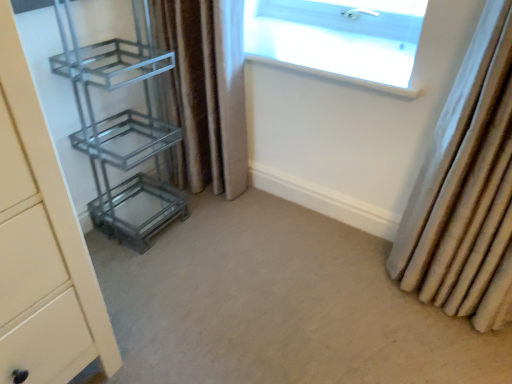
Question: From a real-world perspective, is beige carpet at center below metallic glass shelf at left?

Choices:
 (A) no
 (B) yes

Answer: (B)

Question: Is beige carpet at center facing away from metallic glass shelf at left?

Choices:
 (A) no
 (B) yes

Answer: (A)

Question: Does beige carpet at center lie in front of metallic glass shelf at left?

Choices:
 (A) yes
 (B) no

Answer: (A)

Question: Are beige carpet at center and metallic glass shelf at left far apart?

Choices:
 (A) no
 (B) yes

Answer: (A)

Question: Does beige carpet at center have a lesser height compared to metallic glass shelf at left?

Choices:
 (A) no
 (B) yes

Answer: (B)

Question: In the image, is beige fabric curtain at right, marked as the second curtain in a left-to-right arrangement, positioned in front of or behind transparent glass window at upper center?

Choices:
 (A) behind
 (B) front

Answer: (B)

Question: Would you say beige fabric curtain at right, which is counted as the 1th curtain, starting from the right, is inside or outside transparent glass window at upper center?

Choices:
 (A) outside
 (B) inside

Answer: (A)

Question: In the image, is beige fabric curtain at right, marked as the second curtain in a left-to-right arrangement, on the left side or the right side of transparent glass window at upper center?

Choices:
 (A) right
 (B) left

Answer: (A)

Question: Considering the positions of beige fabric curtain at right, which is counted as the 1th curtain, starting from the right, and transparent glass window at upper center in the image, is beige fabric curtain at right, which is counted as the 1th curtain, starting from the right, bigger or smaller than transparent glass window at upper center?

Choices:
 (A) big
 (B) small

Answer: (A)

Question: Considering their positions, is transparent glass window at upper center located in front of or behind beige carpet at center?

Choices:
 (A) front
 (B) behind

Answer: (B)

Question: Would you say transparent glass window at upper center is inside or outside beige carpet at center?

Choices:
 (A) outside
 (B) inside

Answer: (A)

Question: Considering the positions of transparent glass window at upper center and beige carpet at center in the image, is transparent glass window at upper center bigger or smaller than beige carpet at center?

Choices:
 (A) big
 (B) small

Answer: (B)

Question: From a real-world perspective, is transparent glass window at upper center positioned above or below beige carpet at center?

Choices:
 (A) above
 (B) below

Answer: (A)

Question: From the image's perspective, relative to transparent glass window at upper center, is metallic glass shelf at left above or below?

Choices:
 (A) above
 (B) below

Answer: (B)

Question: From a real-world perspective, is metallic glass shelf at left physically located above or below transparent glass window at upper center?

Choices:
 (A) below
 (B) above

Answer: (A)